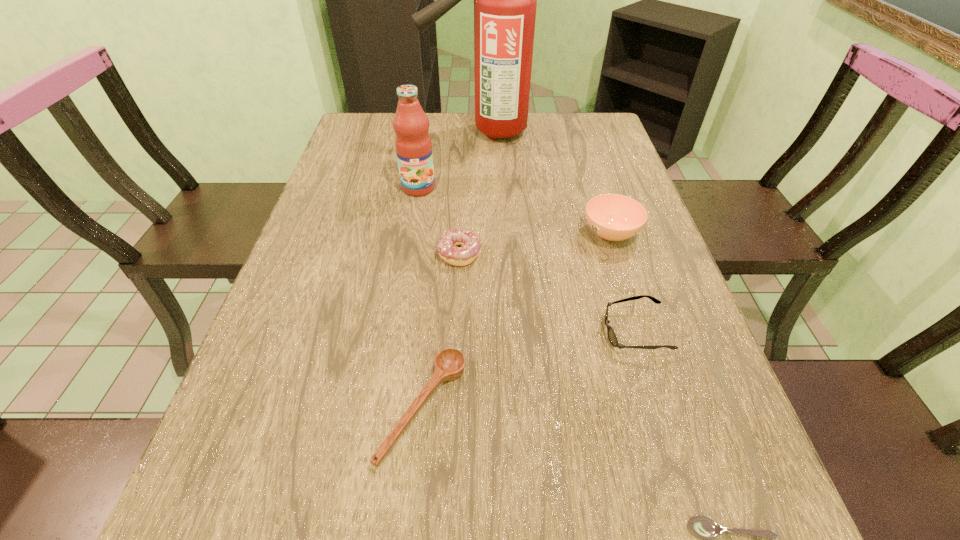
What are the coordinates of `sunglasses present at the right edge` in the screenshot? It's located at (612, 337).

The width and height of the screenshot is (960, 540). In order to click on vacant space at the far edge of the desktop in this screenshot , I will do `click(474, 123)`.

Find the location of `free space at the near edge of the desktop`. free space at the near edge of the desktop is located at coordinates (626, 531).

Identify the location of vacant position at the left edge of the desktop. This screenshot has width=960, height=540. (298, 258).

Find the location of a particular element. This screenshot has height=540, width=960. free space at the right edge of the desktop is located at coordinates (632, 309).

In the image, there is a desktop. Where is `vacant space at the far right corner`? The height and width of the screenshot is (540, 960). vacant space at the far right corner is located at coordinates (587, 148).

Image resolution: width=960 pixels, height=540 pixels. Find the location of `empty space between the doughnut and the sunglasses`. empty space between the doughnut and the sunglasses is located at coordinates (547, 293).

Identify the location of free space between the tallest object and the sixth nearest object. (453, 160).

At what (x,y) coordinates should I click in order to perform the action: click on vacant area between the doughnut and the sunglasses. Please return your answer as a coordinate pair (x, y). Looking at the image, I should click on (547, 293).

Where is `free spot between the doughnut and the sixth shortest object`? Image resolution: width=960 pixels, height=540 pixels. free spot between the doughnut and the sixth shortest object is located at coordinates (439, 221).